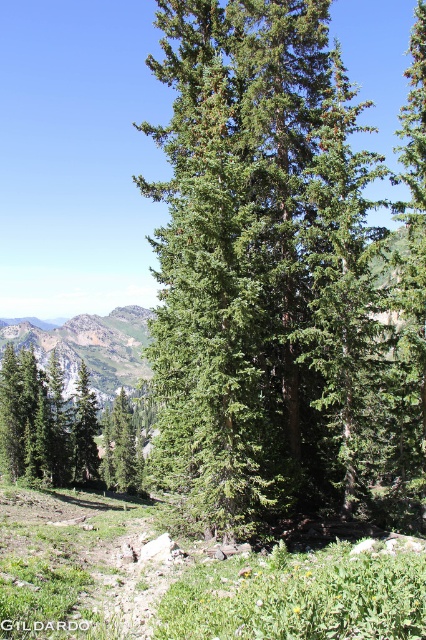
Question: Which point is closer to the camera?

Choices:
 (A) (138, 355)
 (B) (62, 426)
 (C) (170, 458)

Answer: (C)

Question: Which of the following is the farthest from the observer?

Choices:
 (A) green needle-like at center
 (B) green matte tree at lower left
 (C) green leafy mountain at center

Answer: (C)

Question: Considering the relative positions of green needle-like at center and green leafy mountain at center in the image provided, where is green needle-like at center located with respect to green leafy mountain at center?

Choices:
 (A) below
 (B) above

Answer: (B)

Question: Which point is farther from the camera taking this photo?

Choices:
 (A) (62, 362)
 (B) (311, 362)

Answer: (A)

Question: Can you confirm if green needle-like at center is positioned to the left of green leafy mountain at center?

Choices:
 (A) no
 (B) yes

Answer: (A)

Question: Can you confirm if green needle-like at center is positioned to the right of green leafy mountain at center?

Choices:
 (A) yes
 (B) no

Answer: (A)